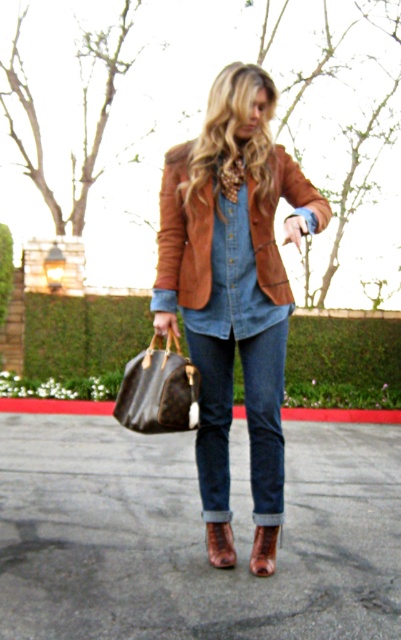
Please describe the exact location of the denim jeans at center in the image using coordinates.

The denim jeans at center are located at coordinates point (265,419).

You are trying to decide whether to wear the brown leather jacket at center or the brown leather boot at lower center for an upcoming event. Based on their sizes, which one would you choose if you prefer something more substantial?

The brown leather jacket at center is bigger than the brown leather boot at lower center, so you should choose the brown leather jacket at center if you prefer something more substantial.

You are a fashion designer observing the person in the image. You need to decide which item to showcase first in your new collection. Based on their size, which item from the suede brown blazer at center and the leather boot at lower center would you choose?

The suede brown blazer at center is bigger than the leather boot at lower center, so it would be the better choice to showcase first in the new collection due to its larger size.